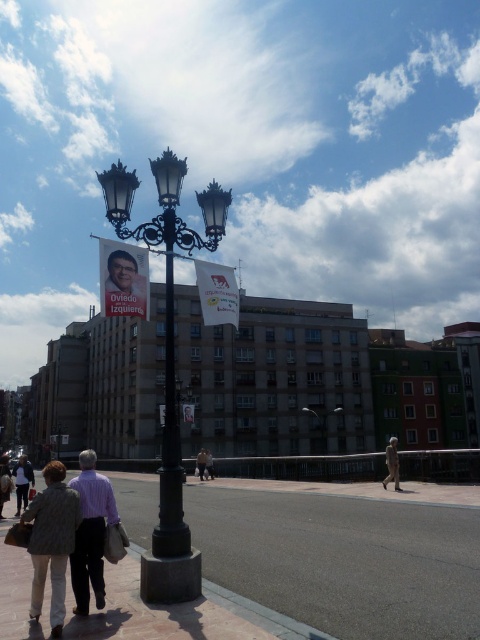
Question: Can you confirm if camouflage fabric jacket at center is smaller than light brown leather jacket at lower left?

Choices:
 (A) yes
 (B) no

Answer: (B)

Question: Among these objects, which one is nearest to the camera?

Choices:
 (A) brown leather jacket at center
 (B) brown brick pavement at lower center

Answer: (B)

Question: Is purple striped shirt at lower left further to the viewer compared to camouflage fabric jacket at center?

Choices:
 (A) yes
 (B) no

Answer: (B)

Question: Is brown brick pavement at lower center thinner than black metal street light at center?

Choices:
 (A) no
 (B) yes

Answer: (A)

Question: Which object is closer to the camera taking this photo?

Choices:
 (A) brown leather jacket at center
 (B) light brown leather jacket at center
 (C) camouflage fabric jacket at center

Answer: (C)

Question: Which point is closer to the camera taking this photo?

Choices:
 (A) (98, 499)
 (B) (169, 422)
 (C) (132, 253)
 (D) (108, 276)

Answer: (A)